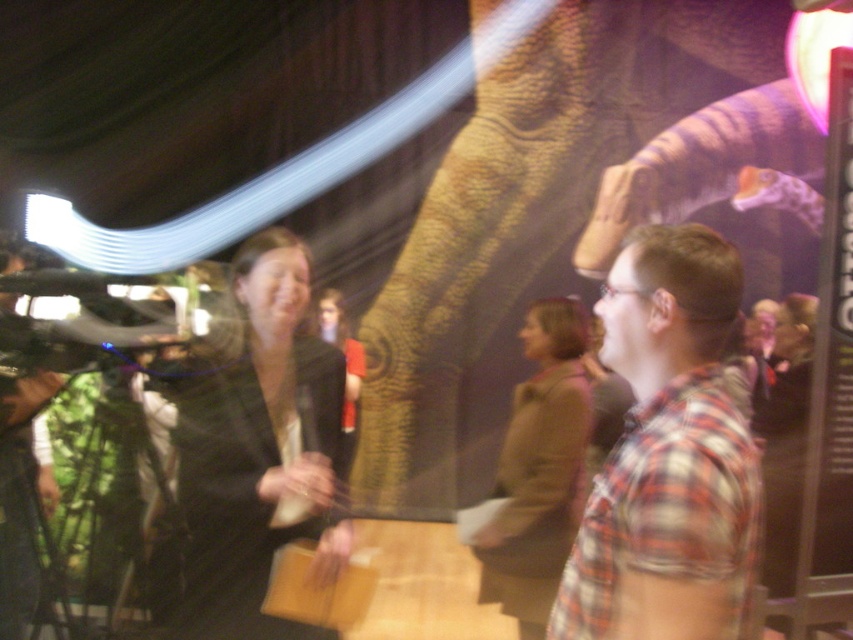
Question: Among these points, which one is farthest from the camera?

Choices:
 (A) (495, 541)
 (B) (457, 429)

Answer: (B)

Question: Is black fabric dress at center closer to camera compared to brown wool sweater at center?

Choices:
 (A) no
 (B) yes

Answer: (B)

Question: Estimate the real-world distances between objects in this image. Which object is farther from the brown wool sweater at center?

Choices:
 (A) brown textured trunk at center
 (B) black fabric dress at center
 (C) plaid cotton shirt at right

Answer: (A)

Question: Among these objects, which one is nearest to the camera?

Choices:
 (A) black fabric dress at center
 (B) plaid cotton shirt at right
 (C) brown wool sweater at center

Answer: (B)

Question: Can you confirm if black fabric dress at center is wider than brown wool sweater at center?

Choices:
 (A) yes
 (B) no

Answer: (A)

Question: Considering the relative positions of brown textured trunk at center and plaid cotton shirt at right in the image provided, where is brown textured trunk at center located with respect to plaid cotton shirt at right?

Choices:
 (A) right
 (B) left

Answer: (B)